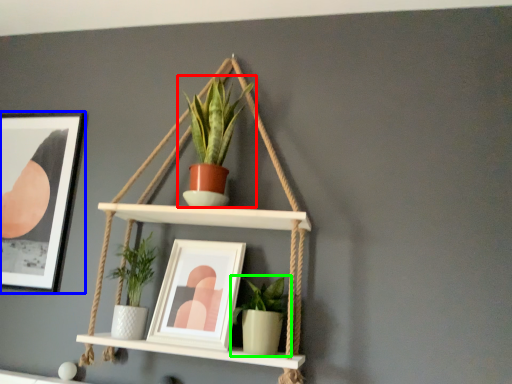
Question: Which object is the closest to the houseplant (highlighted by a red box)? Choose among these: picture frame (highlighted by a blue box) or houseplant (highlighted by a green box).

Choices:
 (A) picture frame
 (B) houseplant

Answer: (B)